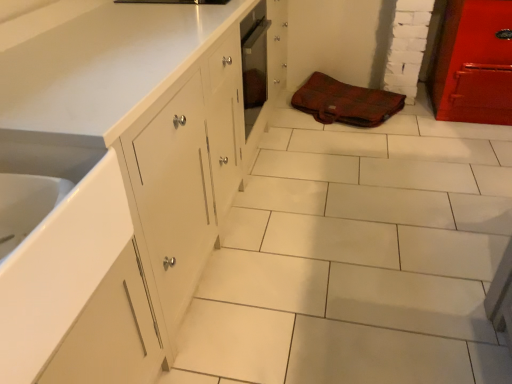
This screenshot has width=512, height=384. What do you see at coordinates (58, 247) in the screenshot?
I see `white glossy sink at lower left` at bounding box center [58, 247].

Where is `white glossy sink at lower left`? white glossy sink at lower left is located at coordinates (58, 247).

Identify the location of brown fabric bag at center. (345, 102).

Image resolution: width=512 pixels, height=384 pixels. Describe the element at coordinates (345, 102) in the screenshot. I see `brown fabric bag at center` at that location.

This screenshot has height=384, width=512. I want to click on white glossy sink at lower left, so click(58, 247).

Is white glossy sink at lower left to the left of brown fabric bag at center from the viewer's perspective?

Yes, white glossy sink at lower left is to the left of brown fabric bag at center.

Between white glossy sink at lower left and brown fabric bag at center, which one is positioned behind?

brown fabric bag at center.

Considering the positions of point (100, 169) and point (336, 89), is point (100, 169) closer or farther from the camera than point (336, 89)?

Point (100, 169) appears to be closer to the viewer than point (336, 89).

From the image's perspective, is white glossy sink at lower left on brown fabric bag at center?

No.

From the picture: From a real-world perspective, relative to brown fabric bag at center, is white glossy sink at lower left vertically above or below?

white glossy sink at lower left is above brown fabric bag at center.

Is white glossy sink at lower left wider or thinner than brown fabric bag at center?

white glossy sink at lower left is thinner than brown fabric bag at center.

Is white glossy sink at lower left taller than brown fabric bag at center?

Yes, white glossy sink at lower left is taller than brown fabric bag at center.

Who is smaller, white glossy sink at lower left or brown fabric bag at center?

With smaller size is brown fabric bag at center.

Is white glossy sink at lower left not within brown fabric bag at center?

Yes, white glossy sink at lower left is outside of brown fabric bag at center.

Is there a large distance between white glossy sink at lower left and brown fabric bag at center?

Yes, white glossy sink at lower left and brown fabric bag at center are quite far apart.

Is white glossy sink at lower left oriented towards brown fabric bag at center?

No, white glossy sink at lower left does not turn towards brown fabric bag at center.

How many degrees apart are the facing directions of white glossy sink at lower left and brown fabric bag at center?

There is a 115-degree angle between the facing directions of white glossy sink at lower left and brown fabric bag at center.

I want to click on sink below the brown fabric bag at center (from the image's perspective), so click(58, 247).

Can you confirm if brown fabric bag at center is positioned to the right of white glossy sink at lower left?

Yes, brown fabric bag at center is to the right of white glossy sink at lower left.

Consider the image. Relative to white glossy sink at lower left, is brown fabric bag at center in front or behind?

brown fabric bag at center is positioned farther from the viewer than white glossy sink at lower left.

Considering the positions of point (361, 93) and point (31, 331), is point (361, 93) closer or farther from the camera than point (31, 331)?

Point (361, 93) is farther from the camera than point (31, 331).

From the image's perspective, would you say brown fabric bag at center is shown under white glossy sink at lower left?

No, from the image's perspective, brown fabric bag at center is not beneath white glossy sink at lower left.

From a real-world perspective, relative to white glossy sink at lower left, is brown fabric bag at center vertically above or below?

brown fabric bag at center is situated lower than white glossy sink at lower left in the real world.

In terms of width, does brown fabric bag at center look wider or thinner when compared to white glossy sink at lower left?

Considering their sizes, brown fabric bag at center looks broader than white glossy sink at lower left.

Which of these two, brown fabric bag at center or white glossy sink at lower left, stands shorter?

brown fabric bag at center is shorter.

In the scene shown: Which of these two, brown fabric bag at center or white glossy sink at lower left, is bigger?

Bigger between the two is white glossy sink at lower left.

In the scene shown: Would you say white glossy sink at lower left is part of brown fabric bag at center's contents?

No, white glossy sink at lower left is not a part of brown fabric bag at center.

Is brown fabric bag at center not close to white glossy sink at lower left?

Yes.

Is brown fabric bag at center oriented towards white glossy sink at lower left?

No, brown fabric bag at center is not oriented towards white glossy sink at lower left.

How different are the orientations of brown fabric bag at center and white glossy sink at lower left in degrees?

brown fabric bag at center and white glossy sink at lower left are facing 115 degrees away from each other.

Find the location of a particular element. This screenshot has width=512, height=384. material above the white glossy sink at lower left (from the image's perspective) is located at coordinates (345, 102).

Find the location of a particular element. This screenshot has height=384, width=512. sink that is on the left side of brown fabric bag at center is located at coordinates (58, 247).

Identify the location of material that is on the right side of white glossy sink at lower left. (345, 102).